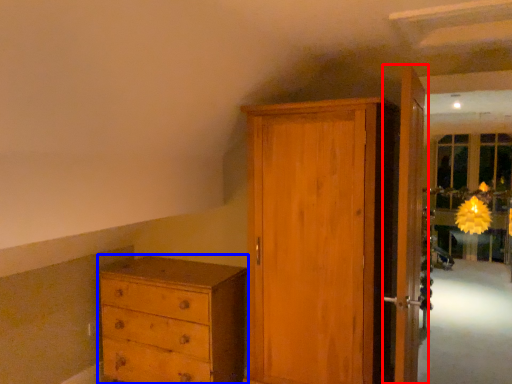
Question: Which of the following is the closest to the observer, door (highlighted by a red box) or chest of drawers (highlighted by a blue box)?

Choices:
 (A) door
 (B) chest of drawers

Answer: (A)